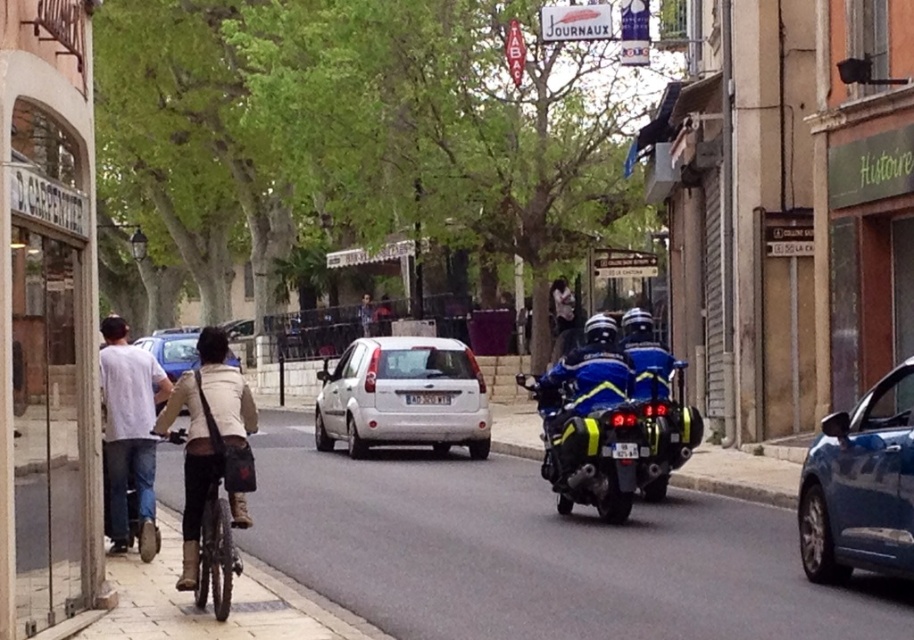
You are standing at the point closer to the camera between point (404,337) and point (126,392). Which point are you standing at?

You are standing at point (126,392) because it is closer to the camera than point (404,337).